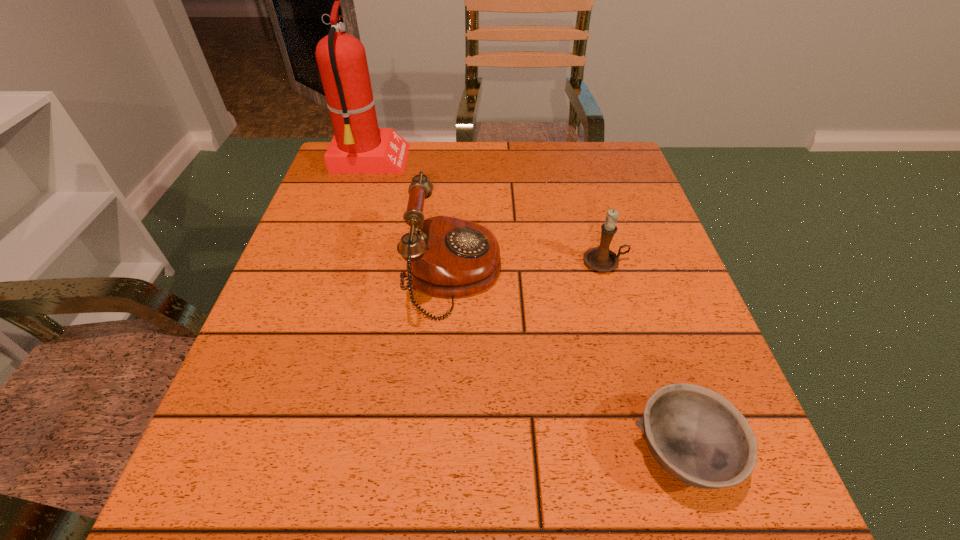
At what (x,y) coordinates should I click in order to perform the action: click on vacant area at the right edge. Please return your answer as a coordinate pair (x, y). This screenshot has width=960, height=540. Looking at the image, I should click on click(x=612, y=291).

This screenshot has width=960, height=540. I want to click on free location at the far left corner of the desktop, so click(373, 182).

In the image, there is a desktop. At what (x,y) coordinates should I click in order to perform the action: click on vacant space at the far right corner. Please return your answer as a coordinate pair (x, y). The image size is (960, 540). Looking at the image, I should click on (609, 175).

The height and width of the screenshot is (540, 960). Find the location of `free space at the near right corner`. free space at the near right corner is located at coordinates (736, 494).

Find the location of `vacant area that lies between the shortest object and the third tallest object`. vacant area that lies between the shortest object and the third tallest object is located at coordinates (643, 357).

Where is `vacant area between the telephone and the third tallest object`? The height and width of the screenshot is (540, 960). vacant area between the telephone and the third tallest object is located at coordinates (529, 268).

Find the location of a particular element. The image size is (960, 540). vacant region between the farthest object and the candle holder is located at coordinates (488, 212).

Identify the location of unoccupied area between the shortest object and the candle holder. This screenshot has width=960, height=540. (643, 357).

Image resolution: width=960 pixels, height=540 pixels. Identify the location of empty location between the second shortest object and the second object from left to right. (529, 268).

At what (x,y) coordinates should I click in order to perform the action: click on blank region between the second object from left to right and the bowl. Please return your answer as a coordinate pair (x, y). Looking at the image, I should click on (568, 363).